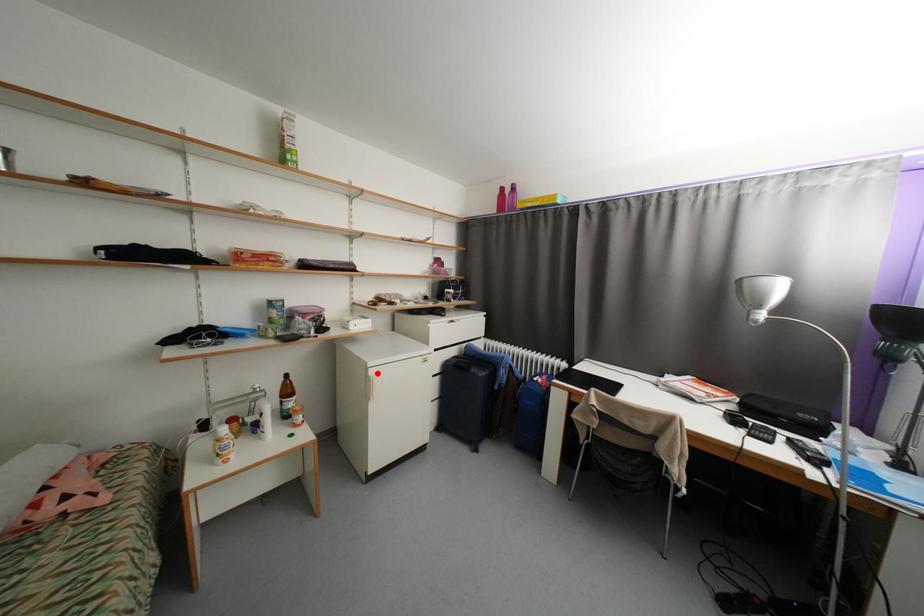
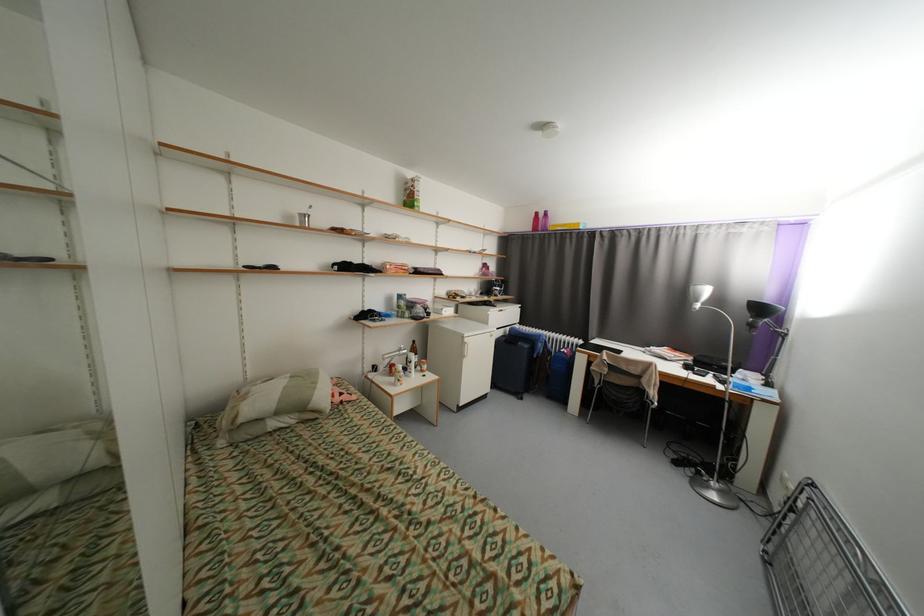
Where in the second image is the point corresponding to the highlighted location from the first image?

(472, 341)